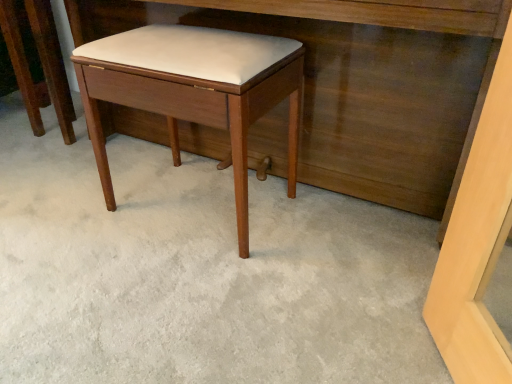
Question: Is matte wood vanity at center with matte wood stool at center?

Choices:
 (A) yes
 (B) no

Answer: (B)

Question: Is matte wood vanity at center wider than matte wood stool at center?

Choices:
 (A) yes
 (B) no

Answer: (A)

Question: Can you confirm if matte wood vanity at center is smaller than matte wood stool at center?

Choices:
 (A) yes
 (B) no

Answer: (B)

Question: Is matte wood vanity at center facing towards matte wood stool at center?

Choices:
 (A) no
 (B) yes

Answer: (B)

Question: Is matte wood vanity at center surrounding matte wood stool at center?

Choices:
 (A) no
 (B) yes

Answer: (B)

Question: From the image's perspective, is matte wood stool at center above or below matte wood stool at center?

Choices:
 (A) below
 (B) above

Answer: (A)

Question: Considering the positions of matte wood stool at center and matte wood stool at center in the image, is matte wood stool at center wider or thinner than matte wood stool at center?

Choices:
 (A) wide
 (B) thin

Answer: (A)

Question: From a real-world perspective, is matte wood stool at center physically located above or below matte wood stool at center?

Choices:
 (A) below
 (B) above

Answer: (A)

Question: Considering the positions of point (x=236, y=125) and point (x=51, y=64), is point (x=236, y=125) closer or farther from the camera than point (x=51, y=64)?

Choices:
 (A) farther
 (B) closer

Answer: (B)

Question: From the image's perspective, is matte wood stool at center above or below matte wood stool at center?

Choices:
 (A) above
 (B) below

Answer: (A)

Question: Relative to matte wood stool at center, is matte wood stool at center in front or behind?

Choices:
 (A) behind
 (B) front

Answer: (A)

Question: Is matte wood stool at center taller or shorter than matte wood stool at center?

Choices:
 (A) short
 (B) tall

Answer: (B)

Question: Would you say matte wood stool at center is inside or outside matte wood stool at center?

Choices:
 (A) inside
 (B) outside

Answer: (B)

Question: Considering the positions of point (245, 157) and point (332, 142), is point (245, 157) closer or farther from the camera than point (332, 142)?

Choices:
 (A) closer
 (B) farther

Answer: (B)

Question: From a real-world perspective, is matte wood stool at center positioned above or below matte wood vanity at center?

Choices:
 (A) below
 (B) above

Answer: (A)